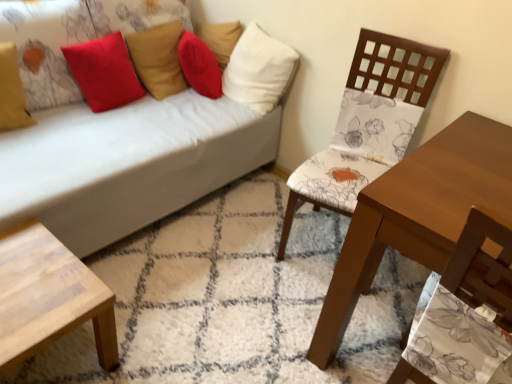
Question: Is floral fabric chair at center right positioned with its back to light wood/texture coffee table at lower left?

Choices:
 (A) no
 (B) yes

Answer: (A)

Question: Can light wood/texture coffee table at lower left be found inside floral fabric chair at center right?

Choices:
 (A) yes
 (B) no

Answer: (B)

Question: From the image's perspective, does floral fabric chair at center right appear higher than light wood/texture coffee table at lower left?

Choices:
 (A) no
 (B) yes

Answer: (B)

Question: From a real-world perspective, is floral fabric chair at center right on top of light wood/texture coffee table at lower left?

Choices:
 (A) yes
 (B) no

Answer: (A)

Question: Is floral fabric chair at center right positioned beyond the bounds of light wood/texture coffee table at lower left?

Choices:
 (A) yes
 (B) no

Answer: (A)

Question: From the image's perspective, is matte yellow pillow at upper left, acting as the 1th pillow starting from the left, positioned above or below red matte pillow at upper left, the 2th pillow when ordered from left to right?

Choices:
 (A) below
 (B) above

Answer: (A)

Question: From a real-world perspective, is matte yellow pillow at upper left, the fourth pillow viewed from the right, physically located above or below red matte pillow at upper left, the 2th pillow when ordered from left to right?

Choices:
 (A) above
 (B) below

Answer: (B)

Question: Considering the positions of matte yellow pillow at upper left, the fourth pillow viewed from the right, and red matte pillow at upper left, the 3th pillow positioned from the right, in the image, is matte yellow pillow at upper left, the fourth pillow viewed from the right, bigger or smaller than red matte pillow at upper left, the 3th pillow positioned from the right,?

Choices:
 (A) small
 (B) big

Answer: (A)

Question: Visually, is matte yellow pillow at upper left, acting as the 1th pillow starting from the left, positioned to the left or to the right of red matte pillow at upper left, the 2th pillow when ordered from left to right?

Choices:
 (A) right
 (B) left

Answer: (B)

Question: Looking at their shapes, would you say light wood/texture coffee table at lower left is wider or thinner than white fabric pillow at upper center, which ranks as the 1th pillow in right-to-left order?

Choices:
 (A) wide
 (B) thin

Answer: (A)

Question: Would you say light wood/texture coffee table at lower left is to the left or to the right of white fabric pillow at upper center, arranged as the fourth pillow when viewed from the left, in the picture?

Choices:
 (A) left
 (B) right

Answer: (A)

Question: Is light wood/texture coffee table at lower left inside or outside of white fabric pillow at upper center, which ranks as the 1th pillow in right-to-left order?

Choices:
 (A) outside
 (B) inside

Answer: (A)

Question: Looking at the image, does light wood/texture coffee table at lower left seem bigger or smaller compared to white fabric pillow at upper center, which ranks as the 1th pillow in right-to-left order?

Choices:
 (A) small
 (B) big

Answer: (A)

Question: From a real-world perspective, is red matte pillow at upper left, the 3th pillow positioned from the right, positioned above or below floral fabric chair at center right?

Choices:
 (A) above
 (B) below

Answer: (A)

Question: In the image, is red matte pillow at upper left, the 3th pillow positioned from the right, positioned in front of or behind floral fabric chair at center right?

Choices:
 (A) behind
 (B) front

Answer: (A)